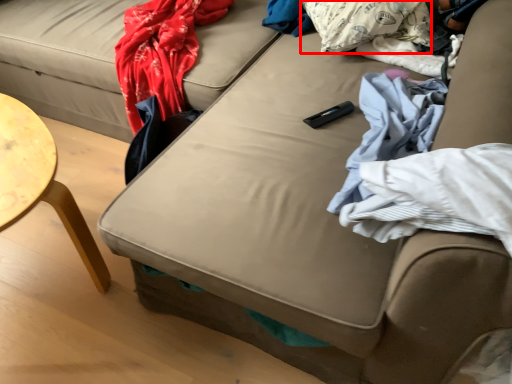
Question: From the image's perspective, where is pillow (annotated by the red box) located relative to material?

Choices:
 (A) below
 (B) above

Answer: (B)